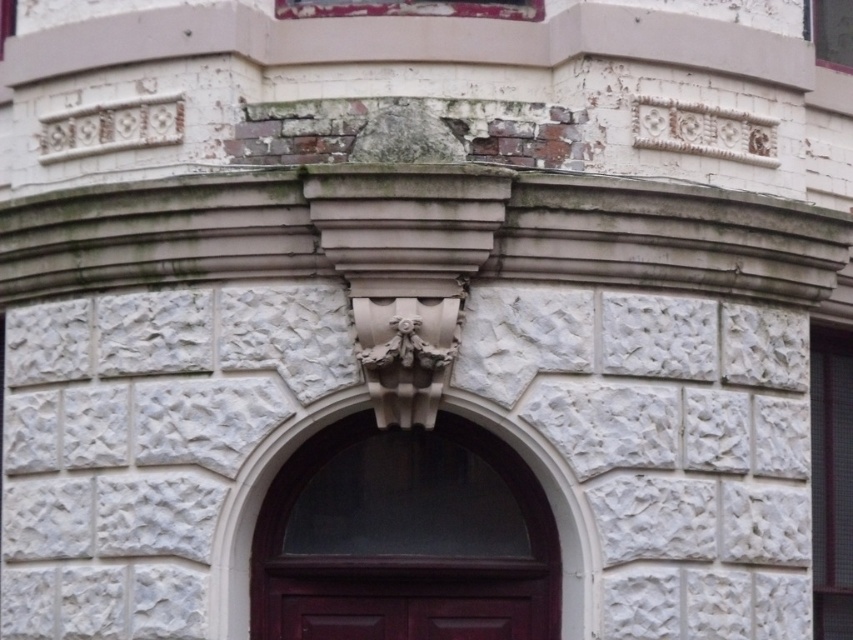
Question: Can you confirm if dark wood door at center is positioned below white stone arch at center?

Choices:
 (A) yes
 (B) no

Answer: (A)

Question: Which object appears closest to the camera in this image?

Choices:
 (A) dark wood door at center
 (B) white stone arch at center

Answer: (A)

Question: In this image, where is dark wood door at center located relative to white stone arch at center?

Choices:
 (A) above
 (B) below

Answer: (B)

Question: Can you confirm if dark wood door at center is positioned above white stone arch at center?

Choices:
 (A) yes
 (B) no

Answer: (B)